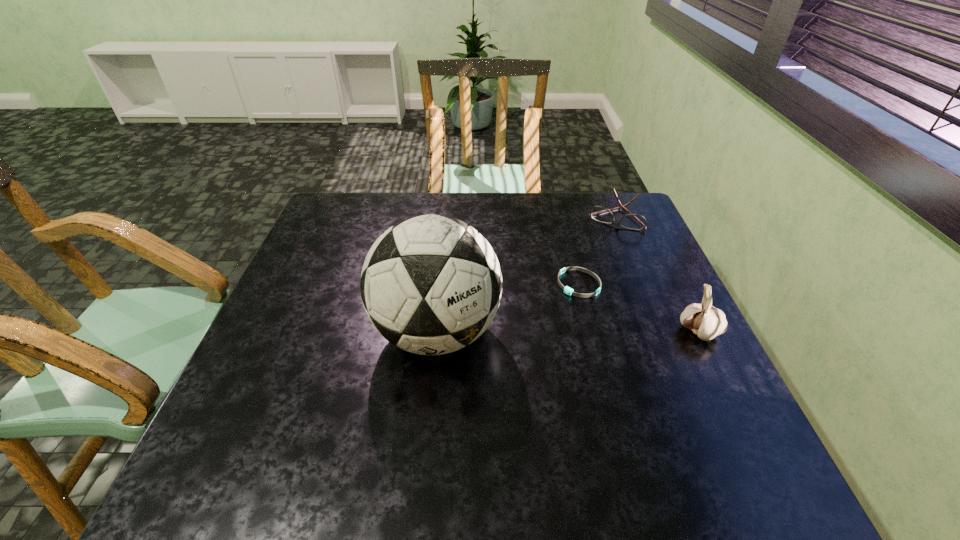
Locate an element on the screen. The width and height of the screenshot is (960, 540). soccer ball is located at coordinates (430, 284).

The image size is (960, 540). What are the coordinates of `the leftmost object` in the screenshot? It's located at (430, 284).

The image size is (960, 540). Identify the location of garlic. (706, 321).

Find the location of a particular element. the farthest object is located at coordinates coord(600,214).

This screenshot has height=540, width=960. What are the coordinates of `the second shortest object` in the screenshot? It's located at click(x=600, y=214).

You are a GUI agent. You are given a task and a screenshot of the screen. Output one action in this format:
    pyautogui.click(x=<x>, y=<y>)
    Task: Click on the wristband
    The image size is (960, 540).
    Given the screenshot: What is the action you would take?
    point(567,290)

At what (x,y) coordinates should I click in order to perform the action: click on the second object from left to right. Please return your answer as a coordinate pair (x, y). The image size is (960, 540). Looking at the image, I should click on (567, 290).

Find the location of `free space located on the back of the garlic`. free space located on the back of the garlic is located at coordinates (645, 224).

Where is `free spot located 0.070m on the front-facing side of the spectacles`? The image size is (960, 540). free spot located 0.070m on the front-facing side of the spectacles is located at coordinates (603, 243).

The image size is (960, 540). What are the coordinates of `vacant region located on the front-facing side of the spectacles` in the screenshot? It's located at 601,247.